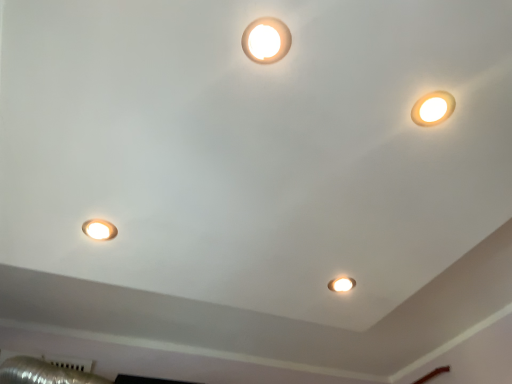
This screenshot has width=512, height=384. I want to click on matte white lamp at upper right, which is counted as the 1th lamp, starting from the right, so click(x=433, y=108).

What do you see at coordinates (433, 108) in the screenshot?
I see `matte white lamp at upper right, the third lamp when ordered from left to right` at bounding box center [433, 108].

Measure the distance between matte white lamp at lower left, the first lamp when ordered from back to front, and camera.

The depth of matte white lamp at lower left, the first lamp when ordered from back to front, is 3.56 feet.

At what (x,y) coordinates should I click in order to perform the action: click on matte white lamp at upper right, which ranks as the second lamp in top-to-bottom order. Please return your answer as a coordinate pair (x, y). Looking at the image, I should click on (433, 108).

Considering the sizes of objects matte white spotlight at center and matte white lamp at lower left, the first lamp when ordered from back to front, in the image provided, who is taller, matte white spotlight at center or matte white lamp at lower left, the first lamp when ordered from back to front,?

Standing taller between the two is matte white spotlight at center.

Based on the photo, considering the sizes of objects matte white spotlight at center and matte white lamp at lower left, positioned as the 3th lamp in top-to-bottom order, in the image provided, who is bigger, matte white spotlight at center or matte white lamp at lower left, positioned as the 3th lamp in top-to-bottom order,?

matte white spotlight at center is bigger.

Would you say matte white spotlight at center is a long distance from matte white lamp at lower left, placed as the 3th lamp when sorted from right to left?

No, matte white spotlight at center is in close proximity to matte white lamp at lower left, placed as the 3th lamp when sorted from right to left.

Is matte white spotlight at center further to the viewer compared to matte white lamp at lower left, the first lamp when ordered from back to front?

Yes, it is behind matte white lamp at lower left, the first lamp when ordered from back to front.

Can you tell me how much matte white spotlight at center and matte white lamp at upper right, marked as the second lamp in a front-to-back arrangement, differ in facing direction?

matte white spotlight at center and matte white lamp at upper right, marked as the second lamp in a front-to-back arrangement, are facing 0.00058 degrees away from each other.

From a real-world perspective, is matte white spotlight at center located beneath matte white lamp at upper right, the third lamp when ordered from left to right?

No, from a real-world perspective, matte white spotlight at center is not beneath matte white lamp at upper right, the third lamp when ordered from left to right.

Does matte white spotlight at center have a lesser width compared to matte white lamp at upper right, which ranks as the second lamp in top-to-bottom order?

Correct, the width of matte white spotlight at center is less than that of matte white lamp at upper right, which ranks as the second lamp in top-to-bottom order.

There is a matte white spotlight at center. Where is `the 2nd lamp below it (from a real-world perspective)`? the 2nd lamp below it (from a real-world perspective) is located at coordinates (433, 108).

Is matte white lamp at upper right, the third lamp when ordered from left to right, far away from matte white lamp at lower left, positioned as the 3th lamp in top-to-bottom order?

matte white lamp at upper right, the third lamp when ordered from left to right, is actually quite close to matte white lamp at lower left, positioned as the 3th lamp in top-to-bottom order.

Does matte white lamp at upper right, the 2th lamp viewed from the back, have a lesser height compared to matte white lamp at lower left, positioned as the 3th lamp in top-to-bottom order?

Correct, matte white lamp at upper right, the 2th lamp viewed from the back, is not as tall as matte white lamp at lower left, positioned as the 3th lamp in top-to-bottom order.

How different are the orientations of matte white lamp at upper right, which ranks as the second lamp in top-to-bottom order, and matte white lamp at lower left, the first lamp when ordered from bottom to top, in degrees?

The facing directions of matte white lamp at upper right, which ranks as the second lamp in top-to-bottom order, and matte white lamp at lower left, the first lamp when ordered from bottom to top, are 180 degrees apart.

Would you say matte white lamp at upper right, which is counted as the 1th lamp, starting from the right, is inside or outside matte white lamp at lower left, placed as the 3th lamp when sorted from right to left?

matte white lamp at upper right, which is counted as the 1th lamp, starting from the right, is spatially situated outside matte white lamp at lower left, placed as the 3th lamp when sorted from right to left.

Considering the relative positions of matte white light fixture at upper center, the first lamp positioned from the front, and matte white lamp at upper right, which ranks as the second lamp in top-to-bottom order, in the image provided, is matte white light fixture at upper center, the first lamp positioned from the front, to the left or to the right of matte white lamp at upper right, which ranks as the second lamp in top-to-bottom order,?

In the image, matte white light fixture at upper center, the first lamp positioned from the front, appears on the left side of matte white lamp at upper right, which ranks as the second lamp in top-to-bottom order.

Is matte white light fixture at upper center, acting as the 3th lamp starting from the bottom, beside matte white lamp at upper right, which ranks as the second lamp in top-to-bottom order?

matte white light fixture at upper center, acting as the 3th lamp starting from the bottom, and matte white lamp at upper right, which ranks as the second lamp in top-to-bottom order, are not in contact.

From a real-world perspective, is matte white light fixture at upper center, which appears as the first lamp when viewed from the top, above or below matte white lamp at upper right, the 2th lamp positioned from the bottom?

matte white light fixture at upper center, which appears as the first lamp when viewed from the top, is above matte white lamp at upper right, the 2th lamp positioned from the bottom.

From the image's perspective, is matte white light fixture at upper center, the first lamp positioned from the front, over matte white lamp at upper right, which ranks as the second lamp in top-to-bottom order?

Yes, from the image's perspective, matte white light fixture at upper center, the first lamp positioned from the front, is on top of matte white lamp at upper right, which ranks as the second lamp in top-to-bottom order.

Is matte white lamp at lower left, the first lamp when ordered from back to front, aimed at matte white spotlight at center?

Yes, matte white lamp at lower left, the first lamp when ordered from back to front, is oriented towards matte white spotlight at center.

Considering the points (109, 235) and (342, 283), which point is in front, point (109, 235) or point (342, 283)?

Point (109, 235)

In the scene shown: From a real-world perspective, who is located higher, matte white lamp at lower left, the first lamp when ordered from back to front, or matte white spotlight at center?

In real-world perspective, matte white spotlight at center is above.

In the scene shown: From a real-world perspective, between matte white lamp at lower left, the 1th lamp from the left, and matte white lamp at upper right, the 2th lamp positioned from the bottom, who is vertically lower?

matte white lamp at lower left, the 1th lamp from the left.

Between matte white lamp at lower left, positioned as the 3th lamp in top-to-bottom order, and matte white lamp at upper right, which is counted as the 1th lamp, starting from the right, which one has larger width?

matte white lamp at upper right, which is counted as the 1th lamp, starting from the right, is wider.

Locate an element on the screen. The width and height of the screenshot is (512, 384). lamp below the matte white lamp at upper right, which is counted as the 1th lamp, starting from the right (from a real-world perspective) is located at coordinates (99, 229).

Are matte white lamp at upper right, marked as the second lamp in a front-to-back arrangement, and matte white spotlight at center located far from each other?

Actually, matte white lamp at upper right, marked as the second lamp in a front-to-back arrangement, and matte white spotlight at center are a little close together.

Does matte white lamp at upper right, the 2th lamp viewed from the back, appear on the right side of matte white spotlight at center?

Yes, matte white lamp at upper right, the 2th lamp viewed from the back, is to the right of matte white spotlight at center.

Consider the image. From the image's perspective, is matte white lamp at upper right, the 2th lamp positioned from the bottom, located above matte white spotlight at center?

Yes.

Where is `stage light below the matte white lamp at lower left, the first lamp when ordered from back to front (from the image's perspective)`? This screenshot has width=512, height=384. stage light below the matte white lamp at lower left, the first lamp when ordered from back to front (from the image's perspective) is located at coordinates (341, 284).

Locate an element on the screen. This screenshot has width=512, height=384. the 2nd lamp below the matte white spotlight at center (from a real-world perspective) is located at coordinates (433, 108).

Considering their positions, is matte white lamp at lower left, which is the third lamp in front-to-back order, positioned closer to matte white spotlight at center than matte white light fixture at upper center, acting as the 3th lamp starting from the bottom?

The object closer to matte white spotlight at center is matte white lamp at lower left, which is the third lamp in front-to-back order.

Looking at the image, which one is located closer to matte white lamp at lower left, the 1th lamp from the left, matte white lamp at upper right, the 2th lamp positioned from the bottom, or matte white spotlight at center?

Based on the image, matte white spotlight at center appears to be nearer to matte white lamp at lower left, the 1th lamp from the left.

Looking at the image, which one is located further to matte white lamp at upper right, the third lamp when ordered from left to right, matte white light fixture at upper center, the first lamp positioned from the front, or matte white spotlight at center?

The object further to matte white lamp at upper right, the third lamp when ordered from left to right, is matte white spotlight at center.

Which object lies further to the anchor point matte white spotlight at center, matte white light fixture at upper center, which appears as the first lamp when viewed from the top, or matte white lamp at lower left, which is the third lamp in front-to-back order?

The object further to matte white spotlight at center is matte white light fixture at upper center, which appears as the first lamp when viewed from the top.

From the image, which object appears to be farther from matte white lamp at lower left, placed as the 3th lamp when sorted from right to left, matte white light fixture at upper center, the first lamp positioned from the front, or matte white spotlight at center?

matte white spotlight at center is further to matte white lamp at lower left, placed as the 3th lamp when sorted from right to left.

From the image, which object appears to be nearer to matte white lamp at lower left, the 1th lamp from the left, matte white lamp at upper right, which ranks as the second lamp in top-to-bottom order, or matte white light fixture at upper center, the 2th lamp from the left?

Among the two, matte white light fixture at upper center, the 2th lamp from the left, is located nearer to matte white lamp at lower left, the 1th lamp from the left.

From the picture: Estimate the real-world distances between objects in this image. Which object is closer to matte white lamp at upper right, which is counted as the 1th lamp, starting from the right, matte white spotlight at center or matte white lamp at lower left, placed as the 3th lamp when sorted from right to left?

matte white spotlight at center is positioned closer to the anchor matte white lamp at upper right, which is counted as the 1th lamp, starting from the right.

When comparing their distances from matte white spotlight at center, does matte white light fixture at upper center, which appears as the 2th lamp when viewed from the right, or matte white lamp at upper right, marked as the second lamp in a front-to-back arrangement, seem further?

matte white light fixture at upper center, which appears as the 2th lamp when viewed from the right, is further to matte white spotlight at center.

Locate an element on the screen. The height and width of the screenshot is (384, 512). lamp between matte white lamp at lower left, the first lamp when ordered from bottom to top, and matte white spotlight at center from left to right is located at coordinates (266, 40).

This screenshot has height=384, width=512. Find the location of `lamp between matte white lamp at lower left, the first lamp when ordered from bottom to top, and matte white lamp at upper right, the third lamp when ordered from left to right`. lamp between matte white lamp at lower left, the first lamp when ordered from bottom to top, and matte white lamp at upper right, the third lamp when ordered from left to right is located at coordinates (266, 40).

Where is `stage light between matte white lamp at lower left, the first lamp when ordered from back to front, and matte white lamp at upper right, which is counted as the 1th lamp, starting from the right, in the horizontal direction`? The image size is (512, 384). stage light between matte white lamp at lower left, the first lamp when ordered from back to front, and matte white lamp at upper right, which is counted as the 1th lamp, starting from the right, in the horizontal direction is located at coordinates (341, 284).